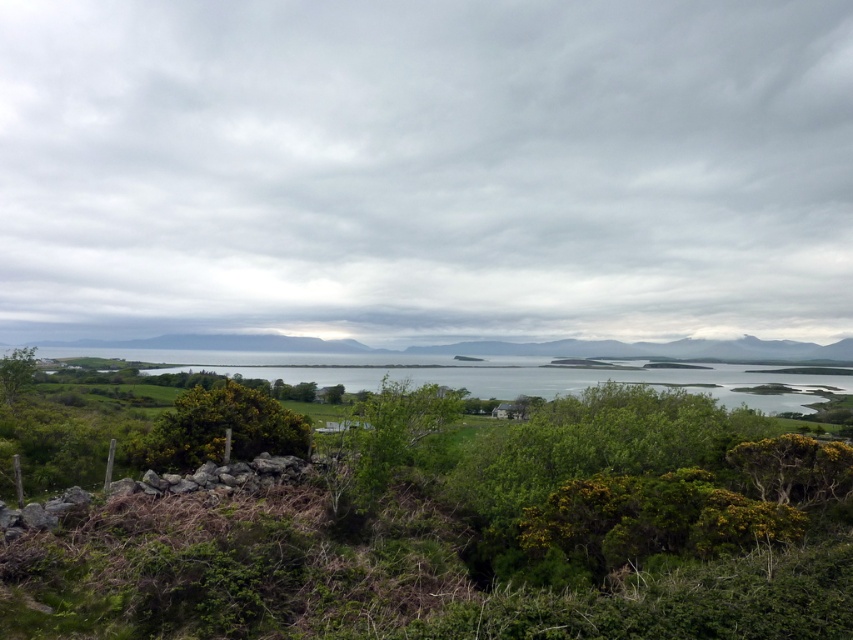
Question: Is green grassy water at center positioned in front of green leafy bush at center?

Choices:
 (A) yes
 (B) no

Answer: (A)

Question: Which point is closer to the camera taking this photo?

Choices:
 (A) 39,548
 (B) 654,376
 (C) 273,38
 (D) 207,397

Answer: (A)

Question: Does green leafy shrubs at center come in front of green leafy bush at center?

Choices:
 (A) no
 (B) yes

Answer: (B)

Question: Is gray cloudy sky at upper center above green leafy shrubs at center?

Choices:
 (A) yes
 (B) no

Answer: (A)

Question: Which point is closer to the camera?

Choices:
 (A) green grassy water at center
 (B) green leafy shrubs at center
 (C) green leafy bush at center

Answer: (B)

Question: Estimate the real-world distances between objects in this image. Which object is closer to the green leafy bush at center?

Choices:
 (A) gray cloudy sky at upper center
 (B) green leafy shrubs at center
 (C) green grassy water at center

Answer: (B)